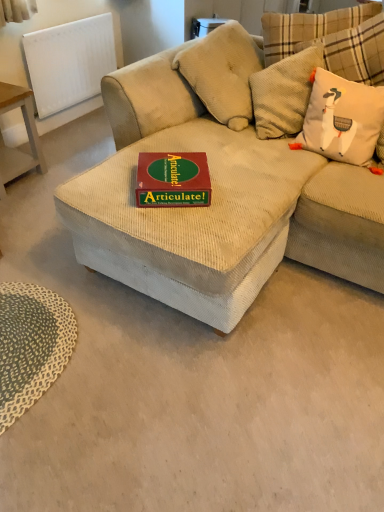
At what (x,y) coordinates should I click in order to perform the action: click on free space to the right of green textured mat at lower left. Please return your answer as a coordinate pair (x, y). This screenshot has width=384, height=512. Looking at the image, I should click on (142, 393).